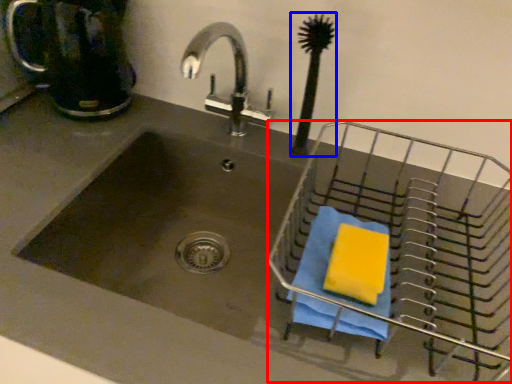
Question: Which object appears farthest to the camera in this image, basket (highlighted by a red box) or brush (highlighted by a blue box)?

Choices:
 (A) basket
 (B) brush

Answer: (B)